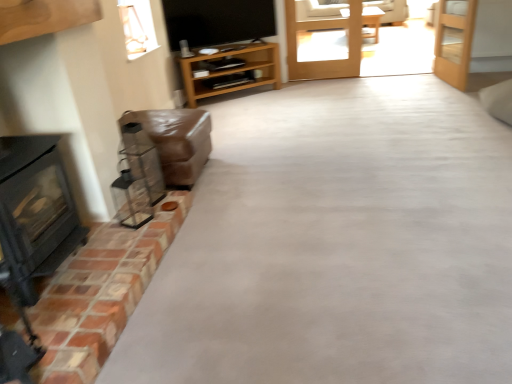
Question: Looking at the image, does wooden door at upper right, placed as the second door when sorted from left to right, seem bigger or smaller compared to clear glass door at center, acting as the first door starting from the left?

Choices:
 (A) big
 (B) small

Answer: (A)

Question: From a real-world perspective, is wooden door at upper right, placed as the second door when sorted from left to right, physically located above or below clear glass door at center, the second door in the right-to-left sequence?

Choices:
 (A) below
 (B) above

Answer: (A)

Question: Estimate the real-world distances between objects in this image. Which object is closer to the wooden shelf at center?

Choices:
 (A) wooden door at upper right, placed as the second door when sorted from left to right
 (B) light brown wooden table at center
 (C) clear glass door at center, the second door in the right-to-left sequence
 (D) red brick fireplace at lower left
 (E) black matte wood burning stove at left

Answer: (C)

Question: Which object is the farthest from the red brick fireplace at lower left?

Choices:
 (A) wooden shelf at center
 (B) clear glass door at center, the second door in the right-to-left sequence
 (C) light brown wooden table at center
 (D) brown leather couch at left
 (E) black matte wood burning stove at left

Answer: (C)